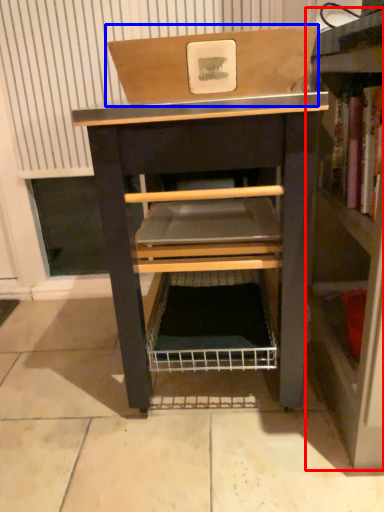
Question: Which of the following is the closest to the observer, shelf (highlighted by a red box) or cardboard box (highlighted by a blue box)?

Choices:
 (A) shelf
 (B) cardboard box

Answer: (A)